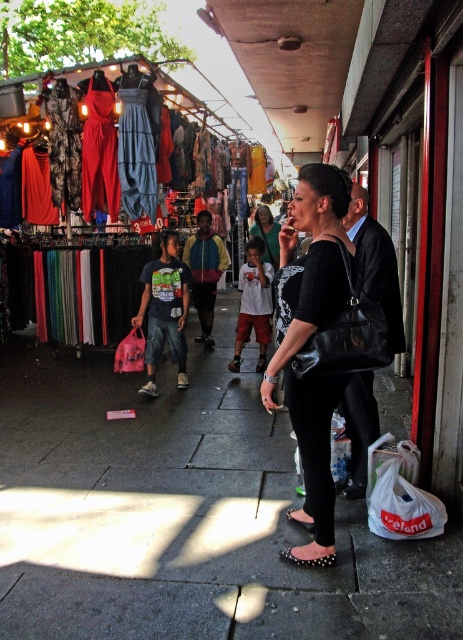
Can you confirm if smooth concrete pavement at center is positioned above black leather purse at center?

No, smooth concrete pavement at center is not above black leather purse at center.

Looking at this image, does smooth concrete pavement at center come behind black leather purse at center?

No, smooth concrete pavement at center is closer to the viewer.

Is point (88, 369) positioned behind point (286, 342)?

Yes, it is behind point (286, 342).

Find the location of a particular element. Image resolution: width=463 pixels, height=640 pixels. smooth concrete pavement at center is located at coordinates (183, 515).

Is matte fabric dresses at left to the right of black studded sandal at lower center from the viewer's perspective?

In fact, matte fabric dresses at left is to the left of black studded sandal at lower center.

Image resolution: width=463 pixels, height=640 pixels. Describe the element at coordinates (161, 132) in the screenshot. I see `matte fabric dresses at left` at that location.

The height and width of the screenshot is (640, 463). What are the coordinates of `matte fabric dresses at left` in the screenshot? It's located at (161, 132).

Is point (220, 312) more distant than point (166, 120)?

Yes.

Between point (62, 637) and point (202, 204), which one is positioned in front?

Point (62, 637) is more forward.

Measure the distance between smooth concrete pavement at center and camera.

A distance of 8.27 feet exists between smooth concrete pavement at center and camera.

Where is `smooth concrete pavement at center`? smooth concrete pavement at center is located at coordinates (183, 515).